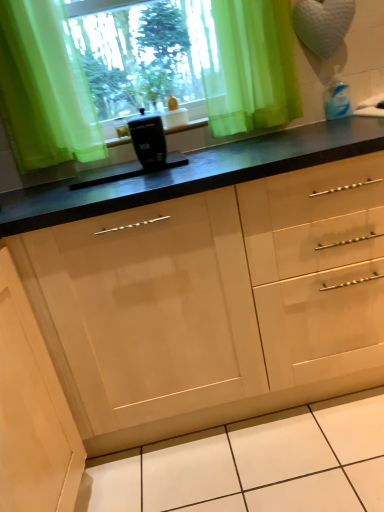
Question: Can you confirm if black plastic container at center is smaller than matte wood cabinet at lower left?

Choices:
 (A) no
 (B) yes

Answer: (B)

Question: From a real-world perspective, is black plastic container at center located higher than matte wood cabinet at lower left?

Choices:
 (A) no
 (B) yes

Answer: (B)

Question: Is black plastic container at center facing away from matte wood cabinet at lower left?

Choices:
 (A) yes
 (B) no

Answer: (B)

Question: Considering the relative sizes of black plastic container at center and matte wood cabinet at lower left in the image provided, is black plastic container at center thinner than matte wood cabinet at lower left?

Choices:
 (A) no
 (B) yes

Answer: (B)

Question: Does black plastic container at center lie in front of matte wood cabinet at lower left?

Choices:
 (A) yes
 (B) no

Answer: (B)

Question: From a real-world perspective, is black plastic container at center physically located above or below black plastic coffee maker at center?

Choices:
 (A) below
 (B) above

Answer: (B)

Question: In the image, is black plastic container at center on the left side or the right side of black plastic coffee maker at center?

Choices:
 (A) right
 (B) left

Answer: (B)

Question: In terms of height, does black plastic container at center look taller or shorter compared to black plastic coffee maker at center?

Choices:
 (A) tall
 (B) short

Answer: (B)

Question: Looking at their shapes, would you say black plastic container at center is wider or thinner than black plastic coffee maker at center?

Choices:
 (A) wide
 (B) thin

Answer: (A)

Question: Is translucent green curtain at upper center to the left or to the right of black plastic container at center in the image?

Choices:
 (A) left
 (B) right

Answer: (B)

Question: Do you think translucent green curtain at upper center is within black plastic container at center, or outside of it?

Choices:
 (A) outside
 (B) inside

Answer: (A)

Question: Is translucent green curtain at upper center bigger or smaller than black plastic container at center?

Choices:
 (A) small
 (B) big

Answer: (B)

Question: In the image, is translucent green curtain at upper center positioned in front of or behind black plastic container at center?

Choices:
 (A) behind
 (B) front

Answer: (B)

Question: Does point (150, 138) appear closer or farther from the camera than point (228, 35)?

Choices:
 (A) farther
 (B) closer

Answer: (B)

Question: Visually, is black plastic coffee maker at center positioned to the left or to the right of translucent green curtain at upper center?

Choices:
 (A) right
 (B) left

Answer: (B)